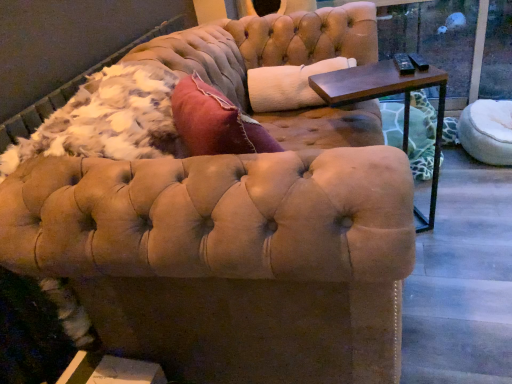
Question: Should I look upward or downward to see transparent glass window screen at upper right?

Choices:
 (A) down
 (B) up

Answer: (B)

Question: Can you confirm if transparent glass window screen at upper right is positioned to the left of dark brown wood side table at upper right?

Choices:
 (A) yes
 (B) no

Answer: (B)

Question: Is transparent glass window screen at upper right not within dark brown wood side table at upper right?

Choices:
 (A) no
 (B) yes

Answer: (B)

Question: From the image's perspective, would you say transparent glass window screen at upper right is positioned over dark brown wood side table at upper right?

Choices:
 (A) no
 (B) yes

Answer: (B)

Question: Is dark brown wood side table at upper right located within transparent glass window screen at upper right?

Choices:
 (A) no
 (B) yes

Answer: (A)

Question: Can you confirm if transparent glass window screen at upper right is wider than dark brown wood side table at upper right?

Choices:
 (A) yes
 (B) no

Answer: (B)

Question: Is transparent glass window screen at upper right taller than dark brown wood side table at upper right?

Choices:
 (A) no
 (B) yes

Answer: (B)

Question: Can you confirm if white fluffy pet bed at right is shorter than dark brown wood side table at upper right?

Choices:
 (A) yes
 (B) no

Answer: (A)

Question: From a real-world perspective, is white fluffy pet bed at right beneath dark brown wood side table at upper right?

Choices:
 (A) no
 (B) yes

Answer: (B)

Question: Would you say white fluffy pet bed at right is outside dark brown wood side table at upper right?

Choices:
 (A) no
 (B) yes

Answer: (B)

Question: Considering the relative sizes of white fluffy pet bed at right and dark brown wood side table at upper right in the image provided, is white fluffy pet bed at right smaller than dark brown wood side table at upper right?

Choices:
 (A) yes
 (B) no

Answer: (A)

Question: Can you confirm if white fluffy pet bed at right is wider than dark brown wood side table at upper right?

Choices:
 (A) yes
 (B) no

Answer: (A)

Question: From a real-world perspective, is white fluffy pet bed at right over dark brown wood side table at upper right?

Choices:
 (A) yes
 (B) no

Answer: (B)

Question: Considering the relative sizes of transparent glass window screen at upper right and white fluffy pet bed at right in the image provided, is transparent glass window screen at upper right taller than white fluffy pet bed at right?

Choices:
 (A) yes
 (B) no

Answer: (A)